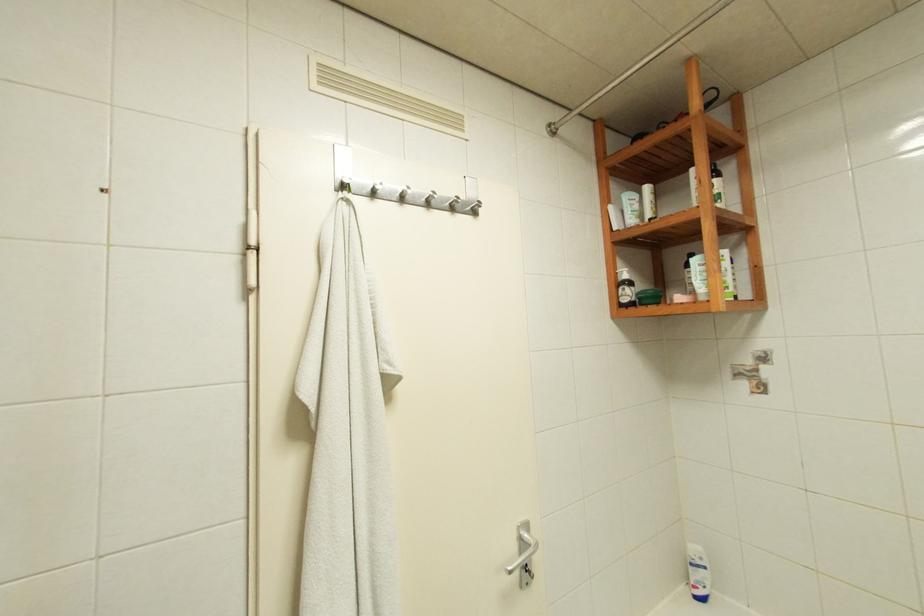
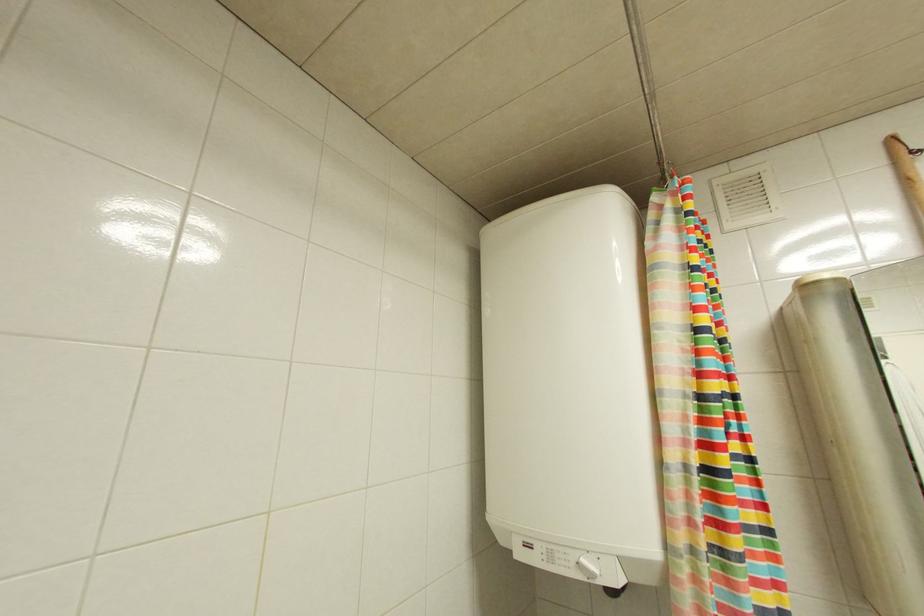
How did the camera likely rotate?

The rotation direction of the camera is right-up.